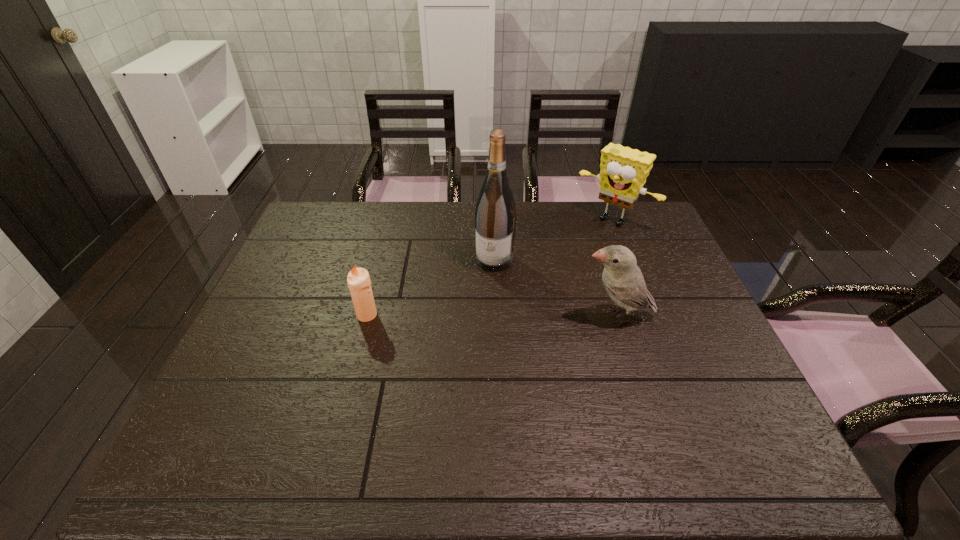
Image resolution: width=960 pixels, height=540 pixels. What are the coordinates of `free space at the far edge of the desktop` in the screenshot? It's located at (398, 218).

In the image, there is a desktop. Identify the location of free space at the near edge. (404, 402).

At what (x,y) coordinates should I click in order to perform the action: click on vacant area at the left edge. Please return your answer as a coordinate pair (x, y). Looking at the image, I should click on (283, 258).

In the image, there is a desktop. At what (x,y) coordinates should I click in order to perform the action: click on free space at the right edge. Please return your answer as a coordinate pair (x, y). Image resolution: width=960 pixels, height=540 pixels. Looking at the image, I should click on (705, 329).

At what (x,y) coordinates should I click in order to perform the action: click on vacant space at the far left corner of the desktop. Please return your answer as a coordinate pair (x, y). The width and height of the screenshot is (960, 540). Looking at the image, I should click on (329, 218).

In order to click on free spot at the far right corner of the desktop in this screenshot , I will do `click(649, 222)`.

The height and width of the screenshot is (540, 960). Identify the location of vacant region between the third object from right to left and the bird. (556, 288).

Locate an element on the screen. This screenshot has height=540, width=960. vacant space that is in between the bird and the candle is located at coordinates (492, 315).

Where is `vacant point located between the candle and the bird`? The height and width of the screenshot is (540, 960). vacant point located between the candle and the bird is located at coordinates (492, 315).

The width and height of the screenshot is (960, 540). I want to click on free spot between the farthest object and the tallest object, so click(x=554, y=240).